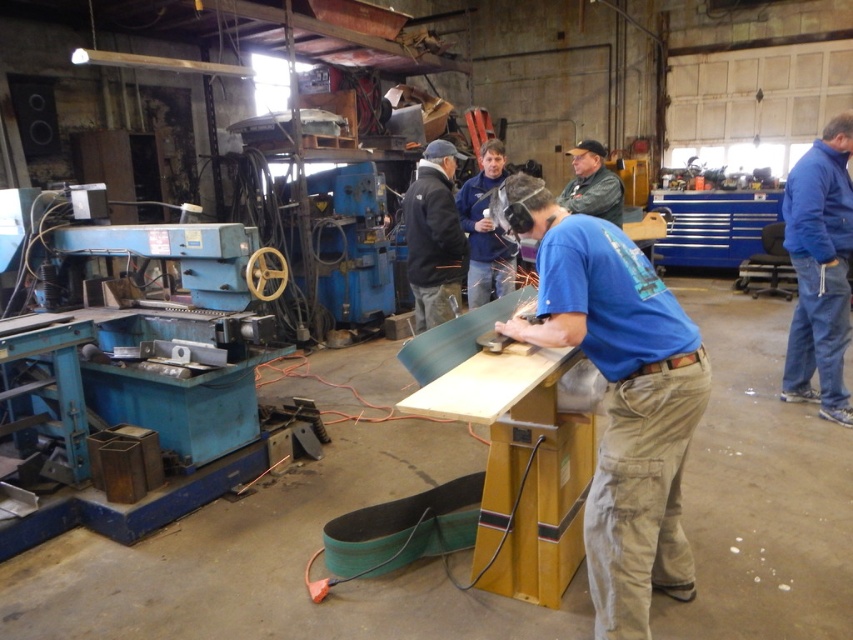
Is point (820, 321) farther from camera compared to point (585, 179)?

No, it is in front of (585, 179).

Is point (799, 225) positioned in front of point (575, 166)?

That is True.

Is point (819, 284) in front of point (579, 182)?

That is True.

Where is `blue fleece jacket at right`? Image resolution: width=853 pixels, height=640 pixels. blue fleece jacket at right is located at coordinates (819, 269).

Can you confirm if blue fleece jacket at right is positioned to the left of blue shirt at center?

In fact, blue fleece jacket at right is to the right of blue shirt at center.

How much distance is there between blue fleece jacket at right and blue shirt at center?

A distance of 1.79 meters exists between blue fleece jacket at right and blue shirt at center.

Does point (782, 380) lie behind point (489, 289)?

No.

What are the coordinates of `blue fleece jacket at right` in the screenshot? It's located at (819, 269).

Can you confirm if dark blue jacket at center is wider than blue shirt at center?

Incorrect, dark blue jacket at center's width does not surpass blue shirt at center's.

Between dark blue jacket at center and blue shirt at center, which one appears on the left side from the viewer's perspective?

dark blue jacket at center is more to the left.

Which is behind, point (421, 326) or point (505, 291)?

The point (505, 291) is more distant.

Where is `dark blue jacket at center`? Image resolution: width=853 pixels, height=640 pixels. dark blue jacket at center is located at coordinates (433, 236).